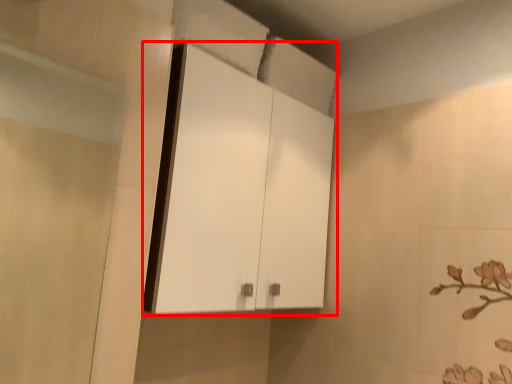
Question: Considering the relative positions of cabinetry (annotated by the red box) and screen door in the image provided, where is cabinetry (annotated by the red box) located with respect to the staircase?

Choices:
 (A) right
 (B) left

Answer: (A)